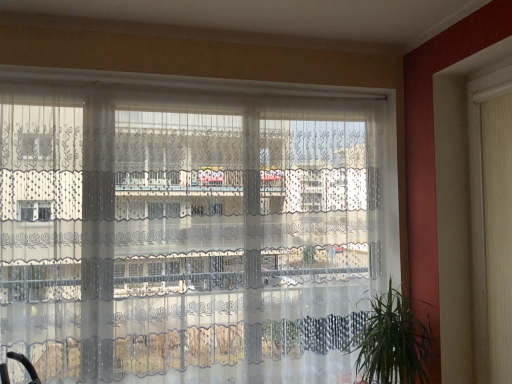
Question: Considering the positions of white fabric shutter at right and green leafy plant at lower right in the image, is white fabric shutter at right taller or shorter than green leafy plant at lower right?

Choices:
 (A) short
 (B) tall

Answer: (B)

Question: Looking at the image, does white fabric shutter at right seem bigger or smaller compared to green leafy plant at lower right?

Choices:
 (A) big
 (B) small

Answer: (B)

Question: Which object is positioned closest to the transparent lace curtains at center?

Choices:
 (A) white fabric shutter at right
 (B) green leafy plant at lower right

Answer: (B)

Question: Estimate the real-world distances between objects in this image. Which object is farther from the white fabric shutter at right?

Choices:
 (A) green leafy plant at lower right
 (B) transparent lace curtains at center

Answer: (B)